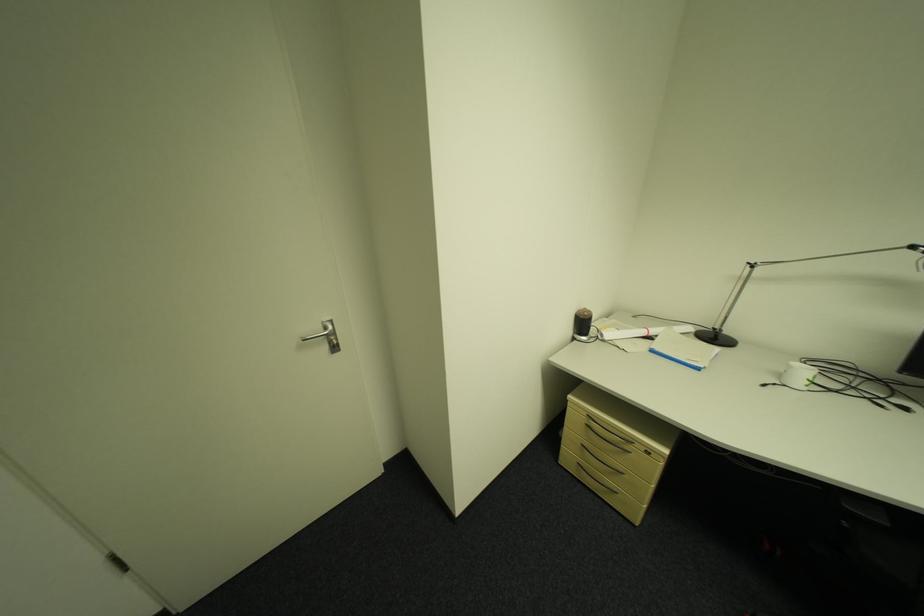
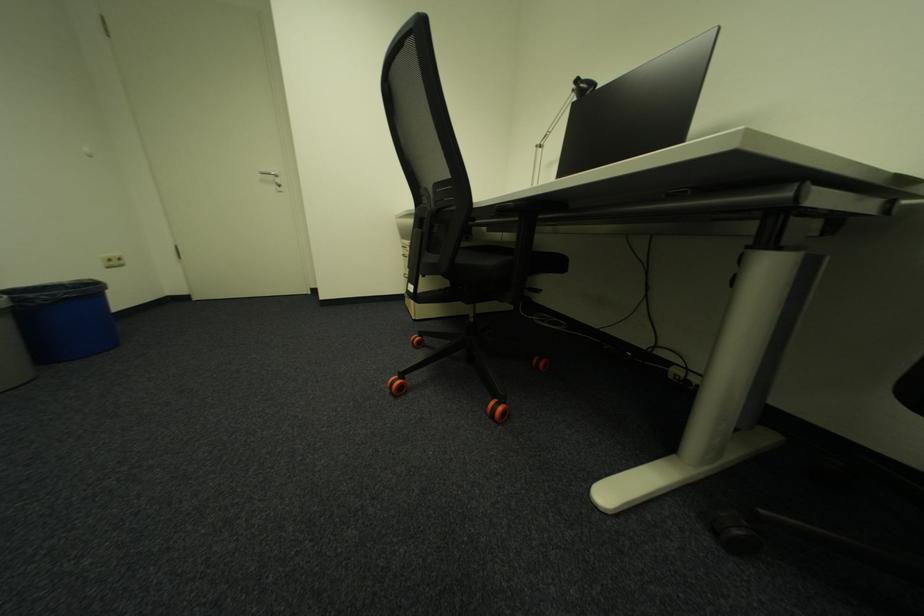
Question: The images are taken continuously from a first-person perspective. In which direction are you moving?

Choices:
 (A) Left
 (B) Right
 (C) Forward
 (D) Backward

Answer: (B)